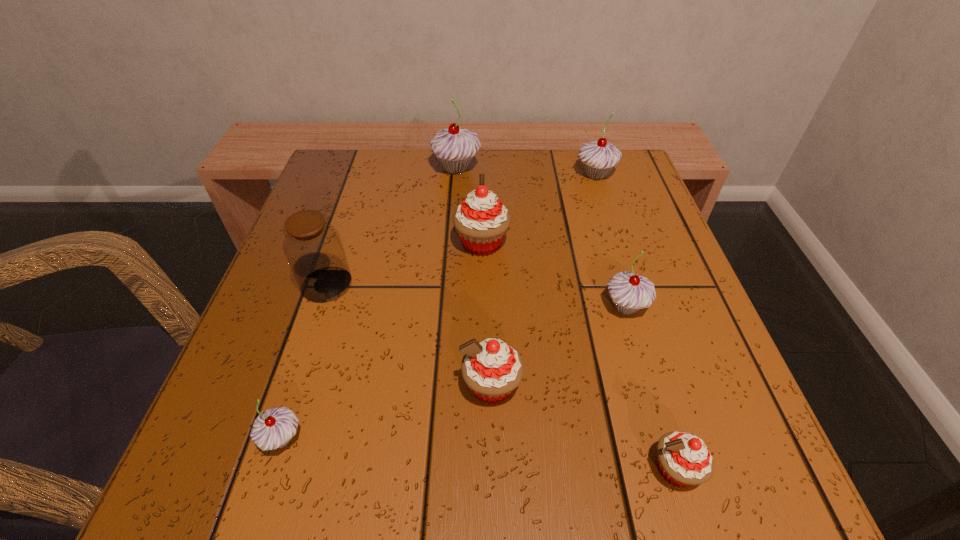
Where is `blank region between the jar and the tallest cupcake`? The image size is (960, 540). blank region between the jar and the tallest cupcake is located at coordinates (391, 226).

Where is `empty location between the third farthest gray cupcake and the third smallest gray cupcake`? The height and width of the screenshot is (540, 960). empty location between the third farthest gray cupcake and the third smallest gray cupcake is located at coordinates (611, 241).

Identify which object is the third nearest to the smallest pink cupcake. Please provide its 2D coordinates. Your answer should be formatted as a tuple, i.e. [(x, y)], where the tuple contains the x and y coordinates of a point satisfying the conditions above.

[(481, 221)]

Locate an element on the screen. The height and width of the screenshot is (540, 960). object that stands as the fifth closest to the third smallest gray cupcake is located at coordinates (314, 250).

Locate an element on the screen. cupcake object that ranks as the fourth closest to the tallest cupcake is located at coordinates (492, 369).

Identify which cupcake is the third closest to the second nearest pink cupcake. Please provide its 2D coordinates. Your answer should be formatted as a tuple, i.e. [(x, y)], where the tuple contains the x and y coordinates of a point satisfying the conditions above.

[(274, 428)]

I want to click on the second closest gray cupcake to the jar, so click(454, 147).

Locate an element on the screen. This screenshot has height=540, width=960. the second closest gray cupcake relative to the third farthest gray cupcake is located at coordinates (454, 147).

Image resolution: width=960 pixels, height=540 pixels. I want to click on pink cupcake object that ranks as the closest to the leftmost cupcake, so click(492, 369).

Select which pink cupcake is the third closest to the second biggest gray cupcake. Please provide its 2D coordinates. Your answer should be formatted as a tuple, i.e. [(x, y)], where the tuple contains the x and y coordinates of a point satisfying the conditions above.

[(684, 459)]